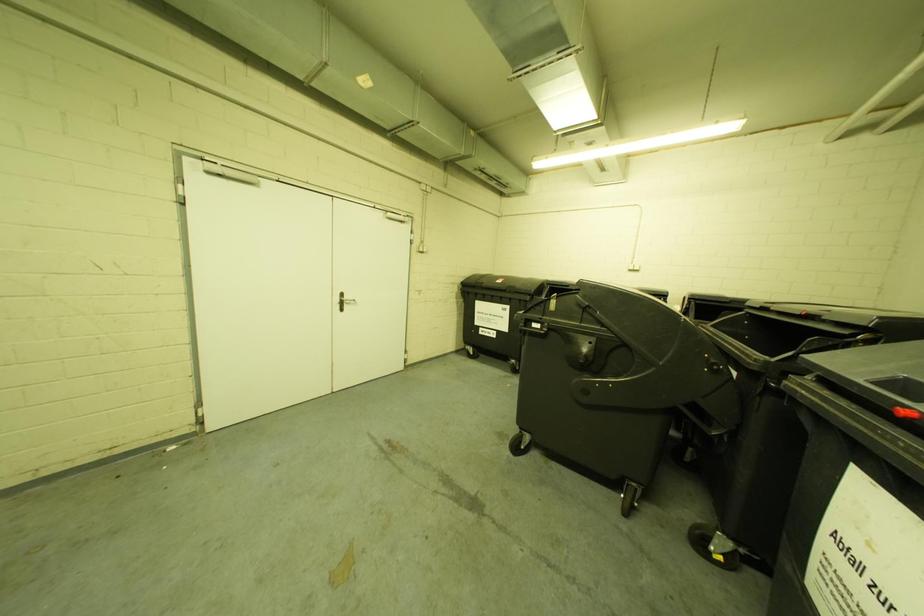
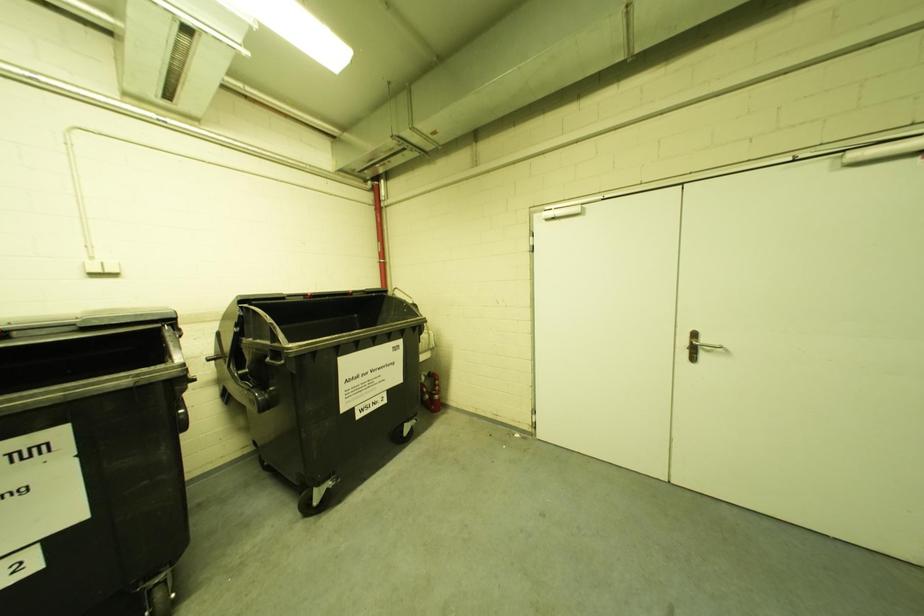
Question: How did the camera likely rotate?

Choices:
 (A) Left
 (B) Right
 (C) Up
 (D) Down

Answer: (A)